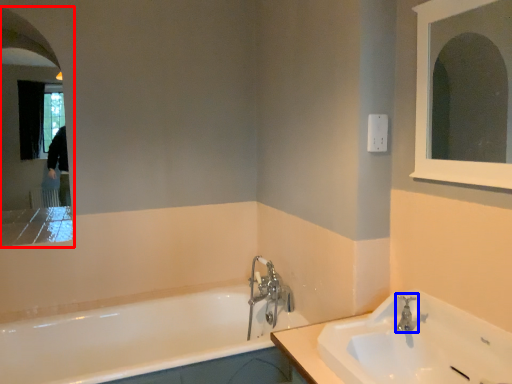
Question: Among these objects, which one is farthest to the camera, medicine cabinet (highlighted by a red box) or tap (highlighted by a blue box)?

Choices:
 (A) medicine cabinet
 (B) tap

Answer: (A)